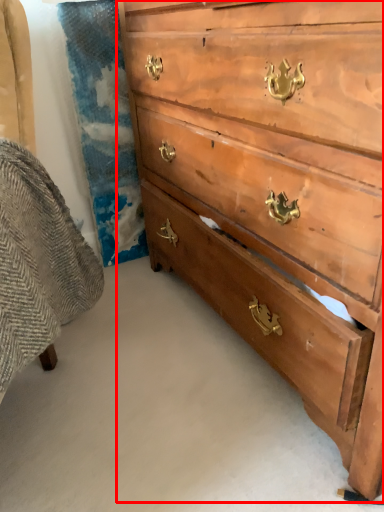
Question: From the image's perspective, what is the correct spatial relationship of chest of drawers (annotated by the red box) in relation to swivel chair?

Choices:
 (A) below
 (B) above

Answer: (B)